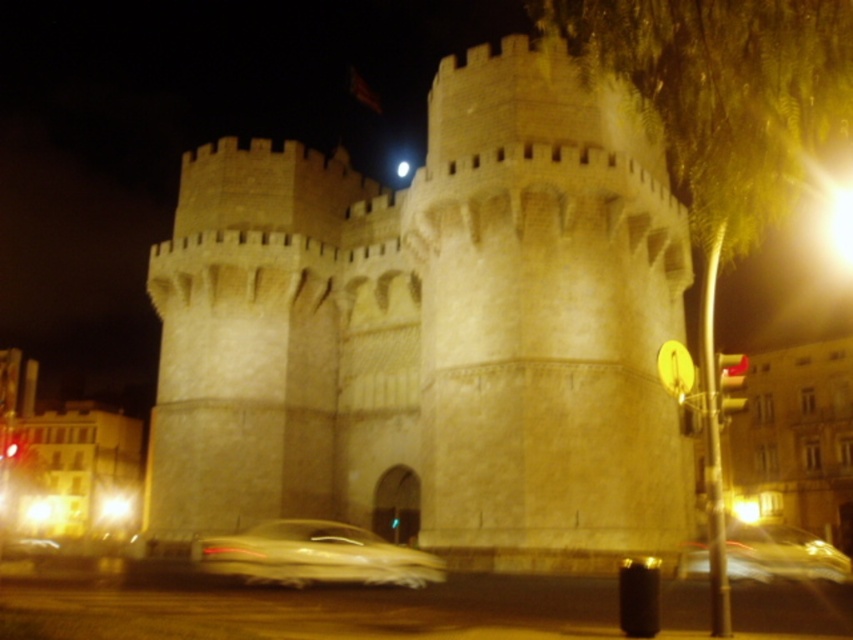
Question: Which of the following is the closest to the observer?

Choices:
 (A) metallic gold car at lower center
 (B) stone castle at center

Answer: (A)

Question: Does stone castle at center have a lesser width compared to metallic gold car at lower center?

Choices:
 (A) no
 (B) yes

Answer: (A)

Question: Does stone castle at center appear on the left side of metallic gold car at lower center?

Choices:
 (A) no
 (B) yes

Answer: (A)

Question: Which point appears farthest from the camera in this image?

Choices:
 (A) (561, 289)
 (B) (357, 540)

Answer: (A)

Question: Can you confirm if stone castle at center is bigger than metallic gold car at lower center?

Choices:
 (A) no
 (B) yes

Answer: (B)

Question: Which of the following is the closest to the observer?

Choices:
 (A) stone castle at center
 (B) metallic gold car at lower center

Answer: (B)